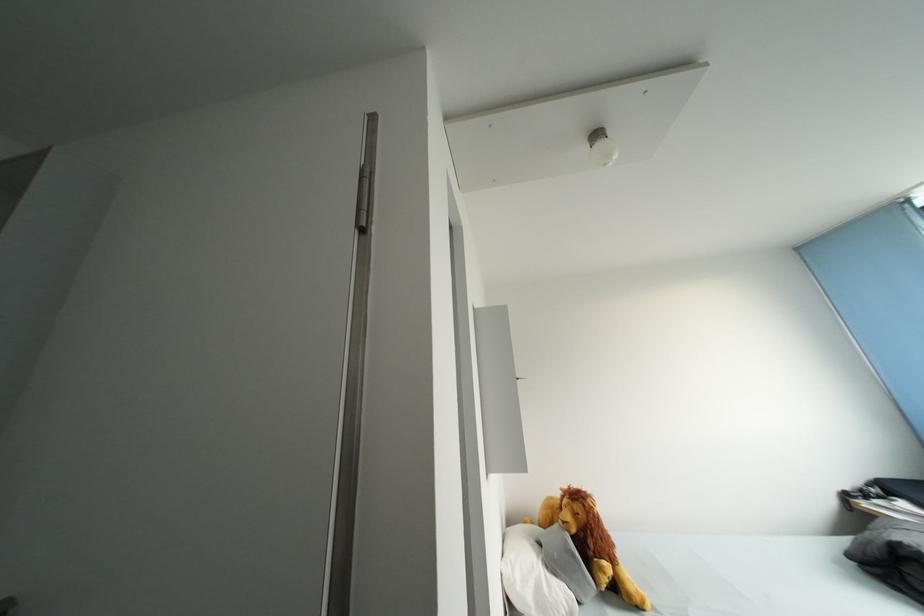
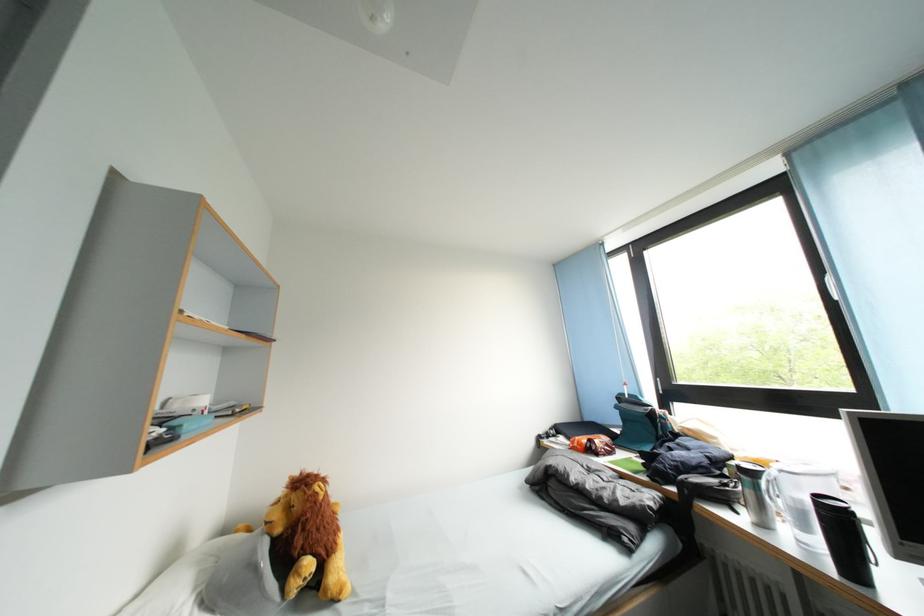
Locate, in the second image, the point that corresponds to point 581,536 in the first image.

(287, 535)